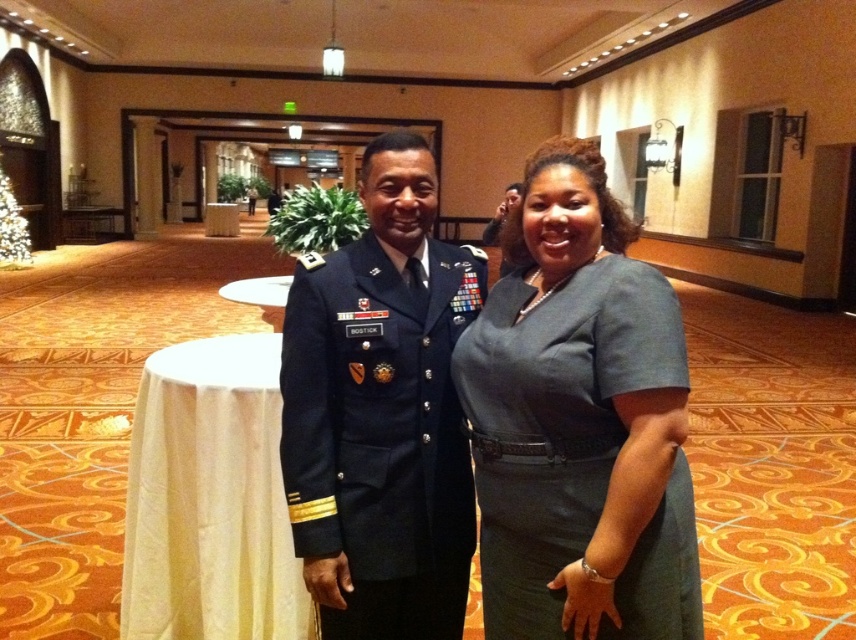
You are a photographer positioned at the camera. You need to capture a closeup shot of the matte gray dress at center. Considering your current position, is the dress within a 4 feet distance range for a clear closeup?

The matte gray dress at center is 4.35 feet away from camera. Since 4.35 feet is slightly beyond the 4 feet range, the dress is just outside the desired distance for a clear closeup.

You are a photographer positioned at the camera. You need to capture a portrait of the navy blue fabric uniform at center. The minimum focusing distance for your camera is 5 feet. Will you be able to take the photo without moving closer?

The distance between the navy blue fabric uniform at center and the camera is 5.18 feet, which is just above the minimum focusing distance of 5 feet. Therefore, you can take the photo without moving closer.